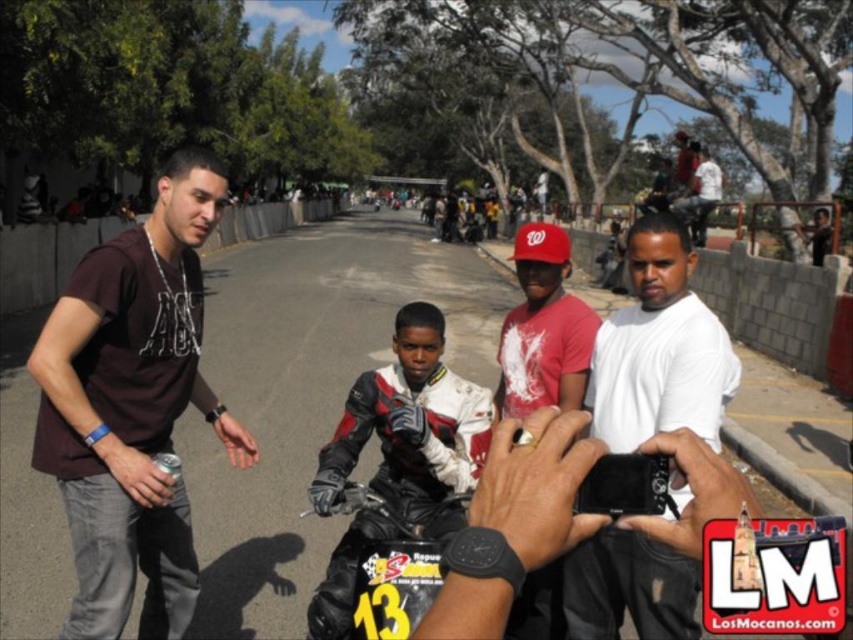
Who is more distant from viewer, (x=158, y=419) or (x=381, y=486)?

The point (x=381, y=486) is behind.

Is dark brown t-shirt at left below black leather motorcycle at center?

No.

Image resolution: width=853 pixels, height=640 pixels. What do you see at coordinates (132, 406) in the screenshot?
I see `dark brown t-shirt at left` at bounding box center [132, 406].

Where is `dark brown t-shirt at left`? The width and height of the screenshot is (853, 640). dark brown t-shirt at left is located at coordinates (132, 406).

Is leather jacket at center shorter than black leather motorcycle at center?

No, leather jacket at center is not shorter than black leather motorcycle at center.

Consider the image. Between leather jacket at center and black leather motorcycle at center, which one has more height?

With more height is leather jacket at center.

Which is behind, point (370, 381) or point (346, 577)?

The point (370, 381) is more distant.

This screenshot has width=853, height=640. In order to click on leather jacket at center in this screenshot , I will do `click(399, 456)`.

Can you confirm if dark brown t-shirt at left is thinner than leather jacket at center?

Indeed, dark brown t-shirt at left has a lesser width compared to leather jacket at center.

Who is higher up, dark brown t-shirt at left or leather jacket at center?

dark brown t-shirt at left is higher up.

Where is `dark brown t-shirt at left`? dark brown t-shirt at left is located at coordinates pyautogui.click(x=132, y=406).

The image size is (853, 640). Identify the location of dark brown t-shirt at left. (132, 406).